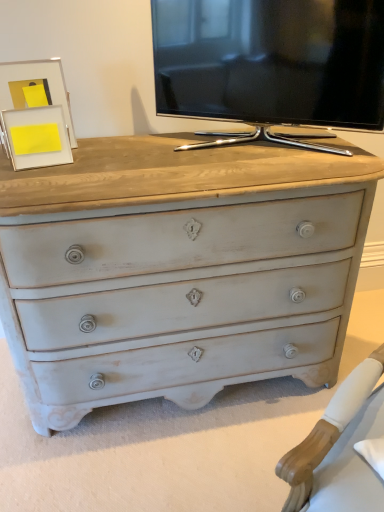
Question: Is matte white picture frame at upper left, positioned as the second picture frame in front-to-back order, bigger than matte white picture frame at upper left, which appears as the second picture frame when viewed from the back?

Choices:
 (A) no
 (B) yes

Answer: (B)

Question: From the image's perspective, is matte white picture frame at upper left, positioned as the second picture frame in front-to-back order, below matte white picture frame at upper left, which appears as the second picture frame when viewed from the back?

Choices:
 (A) yes
 (B) no

Answer: (B)

Question: Can you confirm if matte white picture frame at upper left, positioned as the second picture frame in front-to-back order, is taller than matte white picture frame at upper left, positioned as the 1th picture frame in front-to-back order?

Choices:
 (A) no
 (B) yes

Answer: (B)

Question: Is matte white picture frame at upper left, positioned as the 1th picture frame in back-to-front order, wider than matte white picture frame at upper left, positioned as the 1th picture frame in front-to-back order?

Choices:
 (A) yes
 (B) no

Answer: (A)

Question: Does matte white picture frame at upper left, positioned as the 1th picture frame in back-to-front order, lie in front of matte white picture frame at upper left, which appears as the second picture frame when viewed from the back?

Choices:
 (A) no
 (B) yes

Answer: (A)

Question: Is point (51, 105) positioned closer to the camera than point (304, 113)?

Choices:
 (A) farther
 (B) closer

Answer: (A)

Question: From a real-world perspective, is matte white picture frame at upper left, positioned as the 1th picture frame in front-to-back order, above or below black glossy tv at upper center?

Choices:
 (A) above
 (B) below

Answer: (B)

Question: Visually, is matte white picture frame at upper left, which appears as the second picture frame when viewed from the back, positioned to the left or to the right of black glossy tv at upper center?

Choices:
 (A) left
 (B) right

Answer: (A)

Question: Would you say matte white picture frame at upper left, which appears as the second picture frame when viewed from the back, is inside or outside black glossy tv at upper center?

Choices:
 (A) outside
 (B) inside

Answer: (A)

Question: Considering the positions of point (23, 103) and point (362, 75), is point (23, 103) closer or farther from the camera than point (362, 75)?

Choices:
 (A) farther
 (B) closer

Answer: (A)

Question: Looking at their shapes, would you say matte white picture frame at upper left, positioned as the 1th picture frame in back-to-front order, is wider or thinner than black glossy tv at upper center?

Choices:
 (A) thin
 (B) wide

Answer: (A)

Question: From a real-world perspective, is matte white picture frame at upper left, positioned as the 1th picture frame in back-to-front order, positioned above or below black glossy tv at upper center?

Choices:
 (A) below
 (B) above

Answer: (A)

Question: Is matte white picture frame at upper left, positioned as the second picture frame in front-to-back order, situated inside black glossy tv at upper center or outside?

Choices:
 (A) inside
 (B) outside

Answer: (B)

Question: Looking at the image, does black glossy tv at upper center seem bigger or smaller compared to matte white picture frame at upper left, positioned as the 1th picture frame in back-to-front order?

Choices:
 (A) big
 (B) small

Answer: (A)

Question: Based on their positions, is black glossy tv at upper center located to the left or right of matte white picture frame at upper left, positioned as the second picture frame in front-to-back order?

Choices:
 (A) right
 (B) left

Answer: (A)